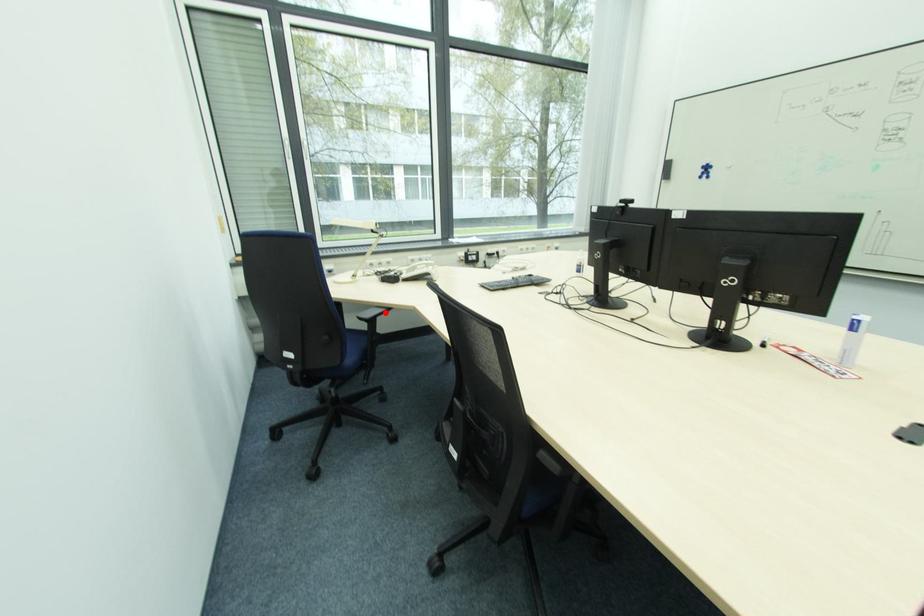
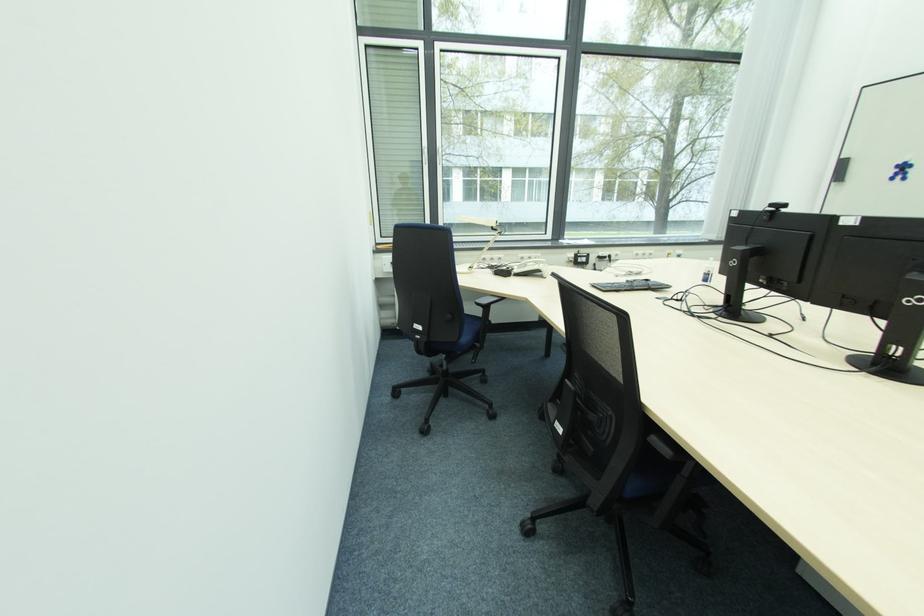
Locate, in the second image, the point that corresponds to the highlighted location in the first image.

(500, 301)